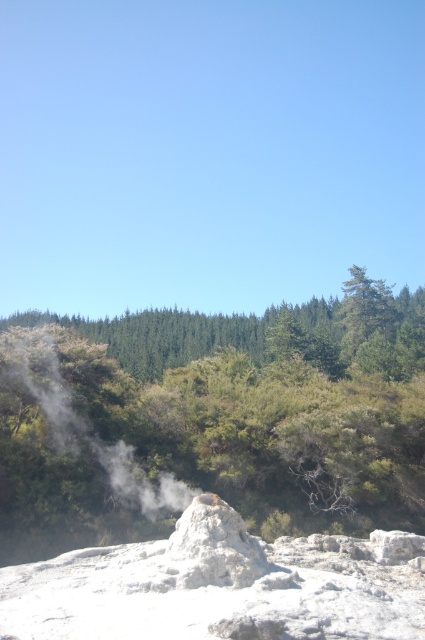
Which is above, green leafy forest at center or white vapor at center?

Positioned higher is green leafy forest at center.

Can you confirm if green leafy forest at center is positioned below white vapor at center?

No, green leafy forest at center is not below white vapor at center.

Which is behind, point (357, 346) or point (71, 488)?

The point (357, 346) is more distant.

You are a GUI agent. You are given a task and a screenshot of the screen. Output one action in this format:
    pyautogui.click(x=<x>, y=<y>)
    Task: Click on the green leafy forest at center
    Image resolution: width=425 pixels, height=640 pixels.
    Given the screenshot: What is the action you would take?
    pyautogui.click(x=217, y=417)

Which is in front, point (84, 426) or point (180, 547)?

Positioned in front is point (180, 547).

Locate an element on the screen. white vapor at center is located at coordinates (74, 433).

Image resolution: width=425 pixels, height=640 pixels. Identify the location of white vapor at center. (74, 433).

Does green leafy forest at center have a lesser height compared to white porous rock at center?

No, green leafy forest at center is not shorter than white porous rock at center.

Between green leafy forest at center and white porous rock at center, which one appears on the left side from the viewer's perspective?

green leafy forest at center

Image resolution: width=425 pixels, height=640 pixels. In order to click on green leafy forest at center in this screenshot , I will do `click(217, 417)`.